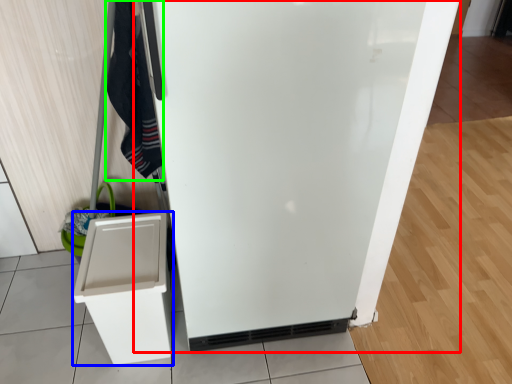
Question: Considering the real-world distances, which object is closest to refrigerator (highlighted by a red box)? cabinetry (highlighted by a blue box) or clothing (highlighted by a green box).

Choices:
 (A) cabinetry
 (B) clothing

Answer: (A)